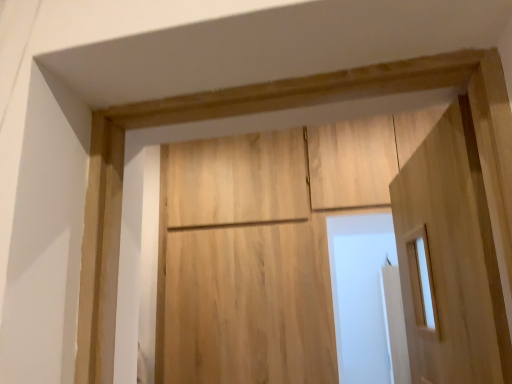
Question: In the image, is natural wood barn door at center positioned in front of or behind light wood door at right?

Choices:
 (A) behind
 (B) front

Answer: (A)

Question: Is point (170, 240) positioned closer to the camera than point (480, 327)?

Choices:
 (A) closer
 (B) farther

Answer: (B)

Question: From the image's perspective, is natural wood barn door at center located above or below light wood door at right?

Choices:
 (A) above
 (B) below

Answer: (B)

Question: Is light wood door at right taller or shorter than natural wood barn door at center?

Choices:
 (A) tall
 (B) short

Answer: (B)

Question: Is light wood door at right wider or thinner than natural wood barn door at center?

Choices:
 (A) thin
 (B) wide

Answer: (B)

Question: From a real-world perspective, relative to natural wood barn door at center, is light wood door at right vertically above or below?

Choices:
 (A) above
 (B) below

Answer: (B)

Question: Is point (493, 271) closer or farther from the camera than point (203, 205)?

Choices:
 (A) farther
 (B) closer

Answer: (B)